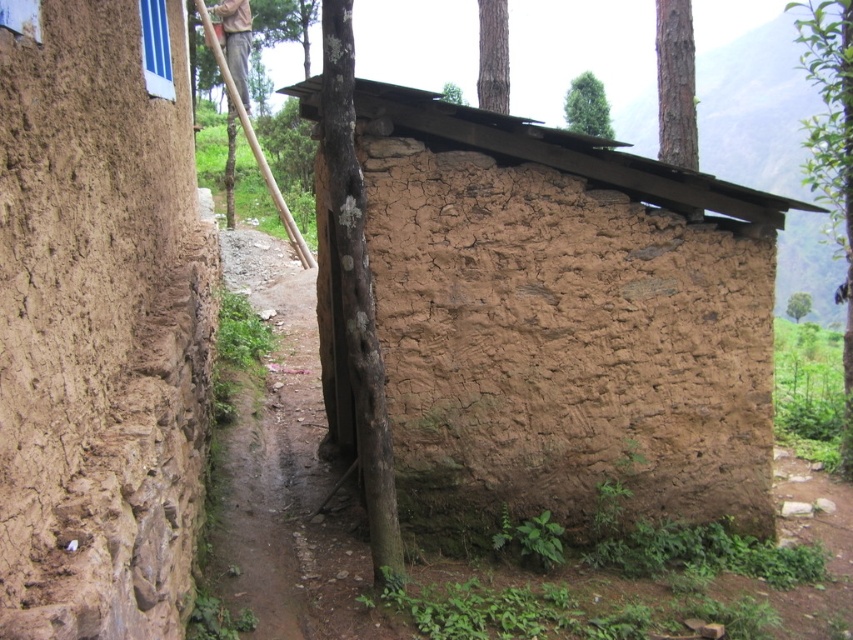
Question: Where is brown mud hut at center located in relation to dusty dirt path at center in the image?

Choices:
 (A) above
 (B) below

Answer: (A)

Question: Does brown mud hut at center have a lesser width compared to dusty dirt path at center?

Choices:
 (A) yes
 (B) no

Answer: (A)

Question: Can you confirm if brown mud hut at center is smaller than dusty dirt path at center?

Choices:
 (A) yes
 (B) no

Answer: (A)

Question: Which of the following is the closest to the observer?

Choices:
 (A) (593, 248)
 (B) (276, 312)

Answer: (A)